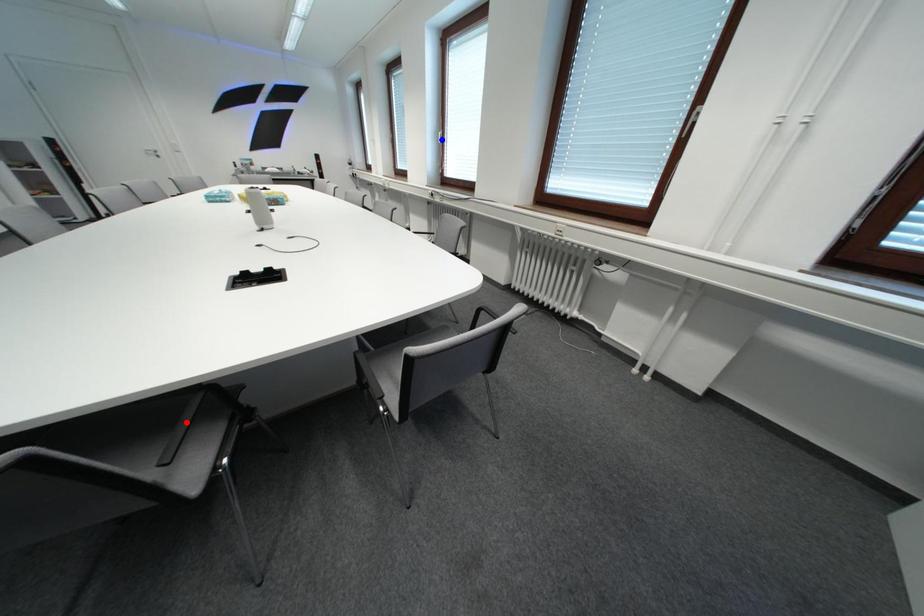
Question: Two points are marked on the image. Which point is closer to the camera?

Choices:
 (A) Blue point is closer.
 (B) Red point is closer.

Answer: (B)